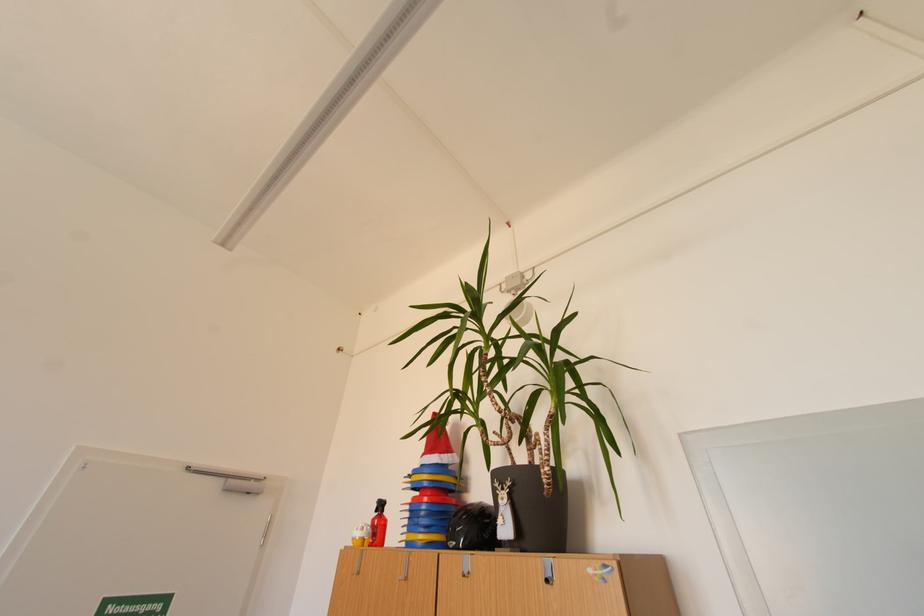
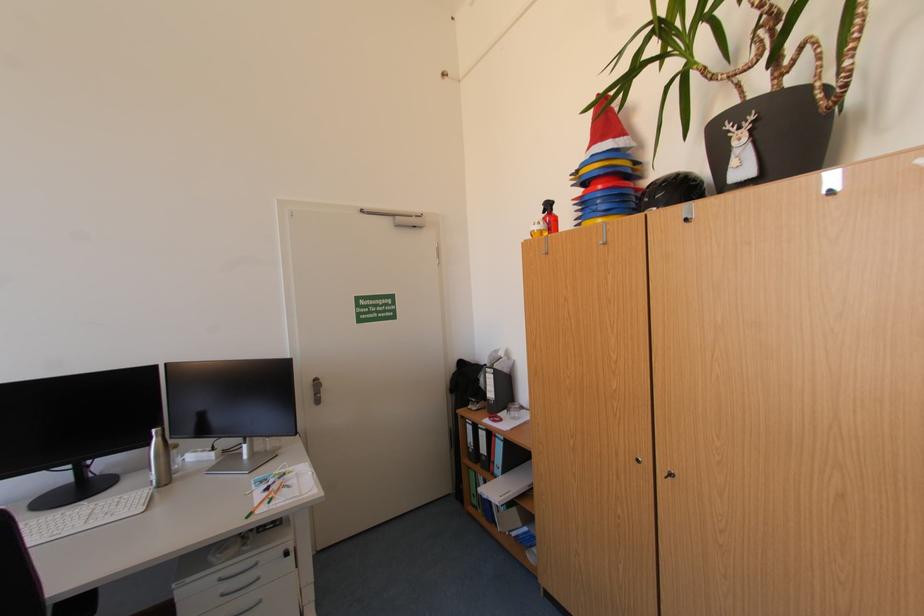
Locate, in the second image, the point that corresponds to [431,514] in the first image.

(606, 203)